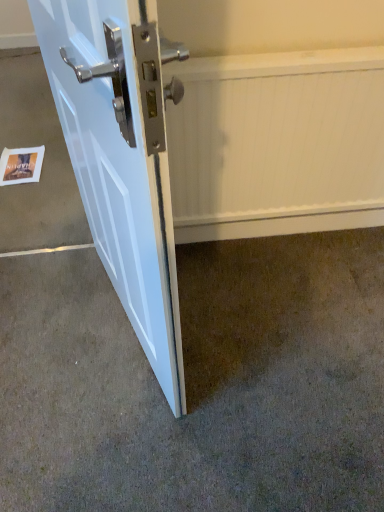
Question: From the image's perspective, is white textured radiator at center beneath white glossy door at lower left?

Choices:
 (A) no
 (B) yes

Answer: (A)

Question: Is white textured radiator at center thinner than white glossy door at lower left?

Choices:
 (A) no
 (B) yes

Answer: (B)

Question: Is white textured radiator at center surrounding white glossy door at lower left?

Choices:
 (A) yes
 (B) no

Answer: (B)

Question: Does white textured radiator at center have a lesser height compared to white glossy door at lower left?

Choices:
 (A) yes
 (B) no

Answer: (A)

Question: Is white textured radiator at center directly adjacent to white glossy door at lower left?

Choices:
 (A) yes
 (B) no

Answer: (B)

Question: From the image's perspective, relative to brown carpet at lower left, is white textured radiator at center above or below?

Choices:
 (A) above
 (B) below

Answer: (A)

Question: Looking at their shapes, would you say white textured radiator at center is wider or thinner than brown carpet at lower left?

Choices:
 (A) thin
 (B) wide

Answer: (A)

Question: Based on their sizes in the image, would you say white textured radiator at center is bigger or smaller than brown carpet at lower left?

Choices:
 (A) big
 (B) small

Answer: (B)

Question: Choose the correct answer: Is white textured radiator at center inside brown carpet at lower left or outside it?

Choices:
 (A) inside
 (B) outside

Answer: (B)

Question: From the image's perspective, is brown carpet at lower left above or below white paper postcard at lower left?

Choices:
 (A) above
 (B) below

Answer: (B)

Question: In the image, is brown carpet at lower left positioned in front of or behind white paper postcard at lower left?

Choices:
 (A) behind
 (B) front

Answer: (B)

Question: Do you think brown carpet at lower left is within white paper postcard at lower left, or outside of it?

Choices:
 (A) inside
 (B) outside

Answer: (B)

Question: Looking at the image, does brown carpet at lower left seem bigger or smaller compared to white paper postcard at lower left?

Choices:
 (A) small
 (B) big

Answer: (B)

Question: Looking at the image, does white textured radiator at center seem bigger or smaller compared to white paper postcard at lower left?

Choices:
 (A) small
 (B) big

Answer: (B)

Question: Is white textured radiator at center inside or outside of white paper postcard at lower left?

Choices:
 (A) inside
 (B) outside

Answer: (B)